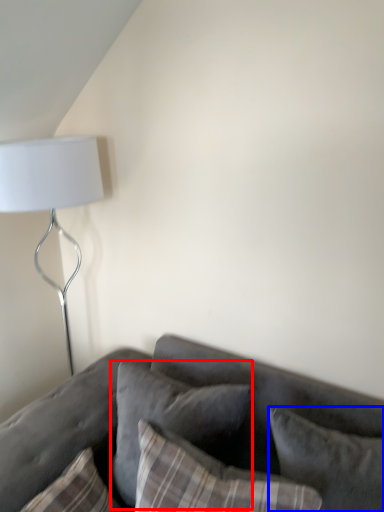
Question: Which point is further to the camera, pillow (highlighted by a red box) or pillow (highlighted by a blue box)?

Choices:
 (A) pillow
 (B) pillow

Answer: (A)